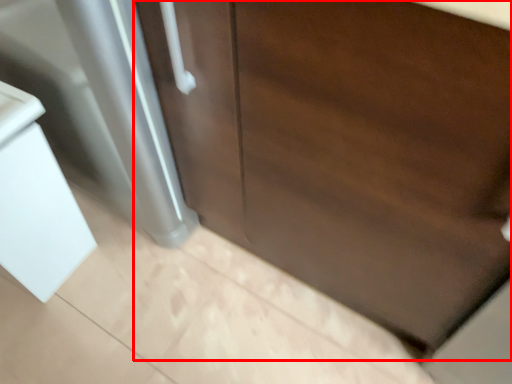
Question: From the image's perspective, considering the relative positions of door (annotated by the red box) and sink in the image provided, where is door (annotated by the red box) located with respect to the staircase?

Choices:
 (A) below
 (B) above

Answer: (B)